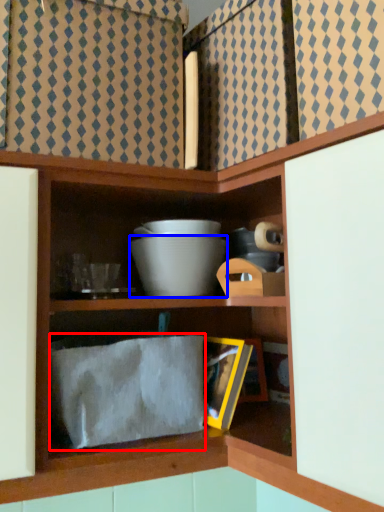
Question: Among these objects, which one is farthest to the camera, cloth (highlighted by a red box) or bowl (highlighted by a blue box)?

Choices:
 (A) cloth
 (B) bowl

Answer: (B)